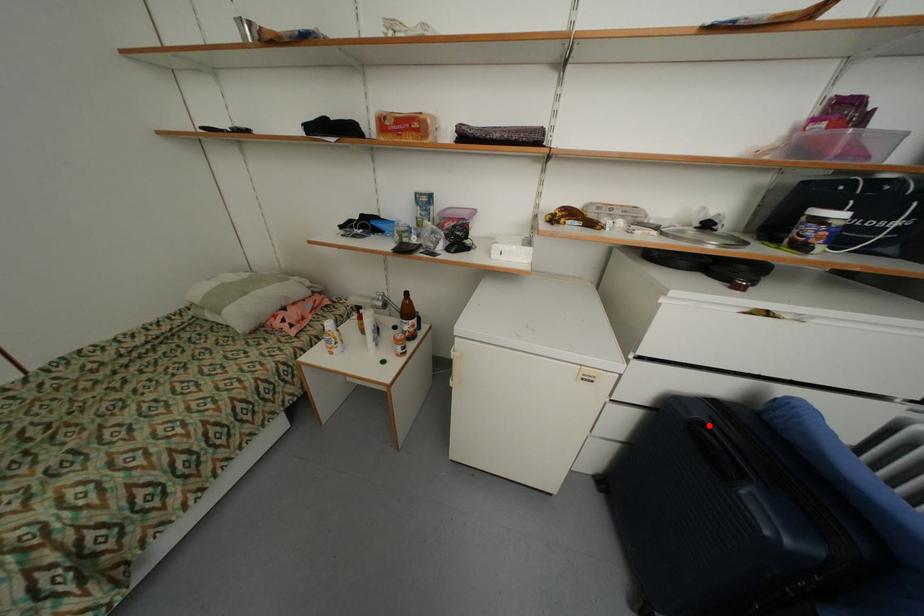
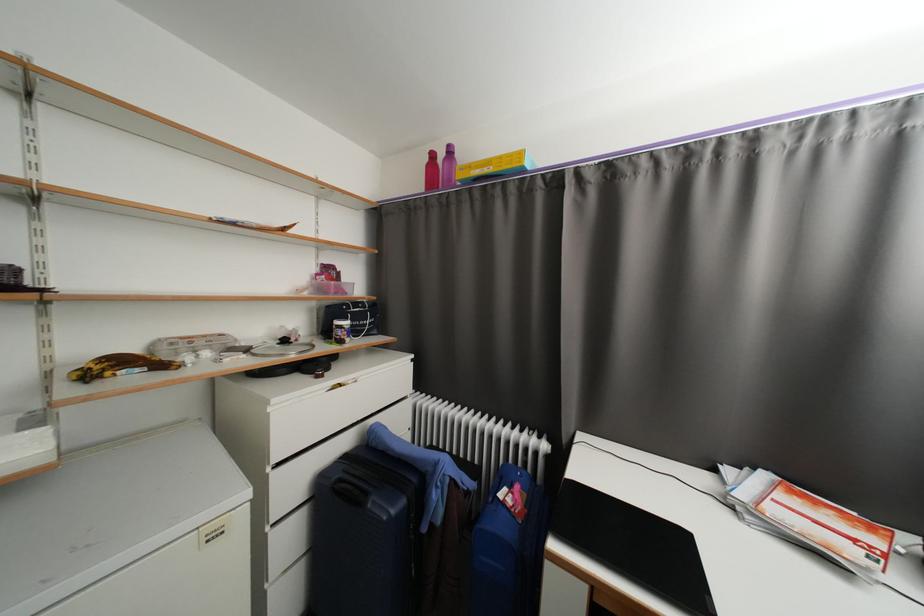
Where in the second image is the point corresponding to the highlighted location from the first image?

(346, 482)